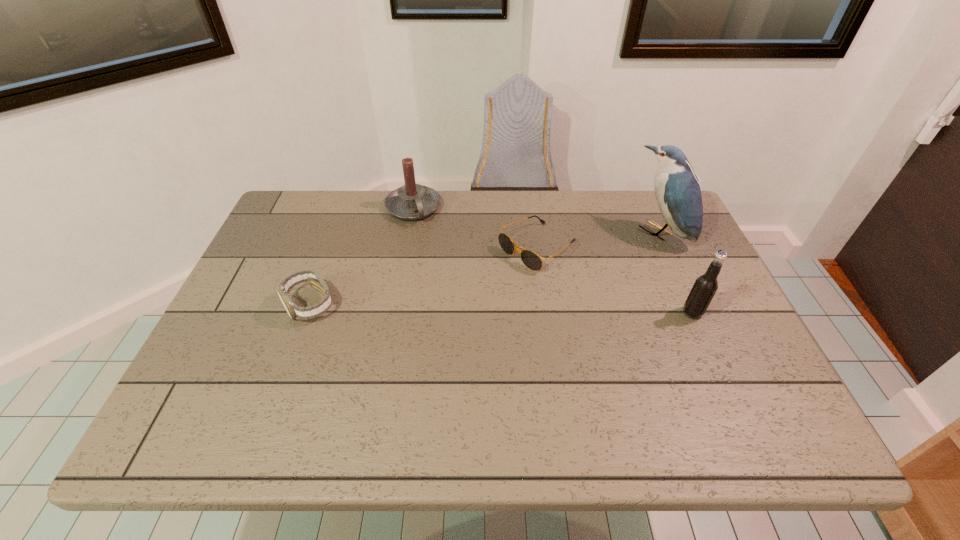
The height and width of the screenshot is (540, 960). Identify the location of the leftmost object. (315, 280).

Locate an element on the screen. This screenshot has width=960, height=540. the fourth tallest object is located at coordinates (315, 280).

The image size is (960, 540). I want to click on root beer, so click(705, 286).

Locate an element on the screen. This screenshot has height=540, width=960. the third object from left to right is located at coordinates (530, 259).

Locate an element on the screen. The image size is (960, 540). sunglasses is located at coordinates (530, 259).

I want to click on candle, so click(x=412, y=201).

The width and height of the screenshot is (960, 540). What are the coordinates of `bird` in the screenshot? It's located at (677, 190).

The image size is (960, 540). I want to click on free location located on the face of the leftmost object, so click(x=281, y=383).

You are a GUI agent. You are given a task and a screenshot of the screen. Output one action in this format:
    pyautogui.click(x=<x>, y=<y>)
    Task: Click on the vacant space located 0.060m on the label of the root beer
    
    Given the screenshot: What is the action you would take?
    pyautogui.click(x=727, y=313)

Where is `free space located on the front-facing side of the shortest object`? This screenshot has width=960, height=540. free space located on the front-facing side of the shortest object is located at coordinates point(423,326).